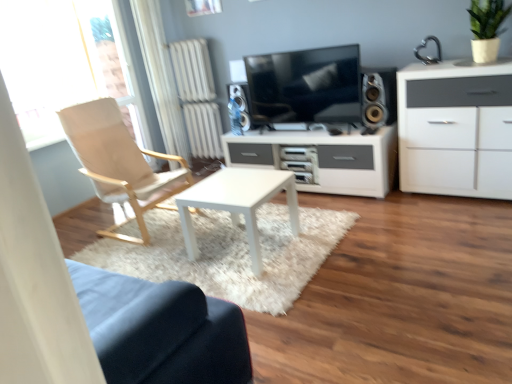
What do you see at coordinates (238, 203) in the screenshot?
I see `white matte coffee table at center` at bounding box center [238, 203].

What do you see at coordinates (456, 129) in the screenshot? I see `white matte cabinet at right` at bounding box center [456, 129].

Describe the element at coordinates (120, 163) in the screenshot. I see `light beige fabric chair at left` at that location.

This screenshot has width=512, height=384. In order to click on satin black speaker at center, the second speaker when ordered from right to left in this screenshot , I will do `click(241, 102)`.

Describe the element at coordinates (65, 62) in the screenshot. I see `transparent glass window at upper left` at that location.

In order to click on white fabric curtain at left in this screenshot , I will do `click(160, 76)`.

Is light beige fabric chair at left positioned before matte black tv at center?

Yes, light beige fabric chair at left is closer to the camera.

Can you confirm if light beige fabric chair at left is thinner than matte black tv at center?

In fact, light beige fabric chair at left might be wider than matte black tv at center.

From the image's perspective, which object appears higher, light beige fabric chair at left or matte black tv at center?

matte black tv at center appears higher in the image.

How many degrees apart are the facing directions of light beige fabric chair at left and matte black tv at center?

The facing directions of light beige fabric chair at left and matte black tv at center are 86.5 degrees apart.

Between white matte cabinet at right and white matte coffee table at center, which one is positioned behind?

white matte cabinet at right is more distant.

Which of these two, white matte cabinet at right or white matte coffee table at center, stands taller?

Standing taller between the two is white matte cabinet at right.

Looking at their sizes, would you say white matte cabinet at right is wider or thinner than white matte coffee table at center?

In the image, white matte cabinet at right appears to be more narrow than white matte coffee table at center.

How many degrees apart are the facing directions of white matte cabinet at right and white matte coffee table at center?

white matte cabinet at right and white matte coffee table at center are facing 0.372 degrees away from each other.

From a real-world perspective, relative to white fabric curtain at left, is white matte cabinet at right vertically above or below?

white matte cabinet at right is situated lower than white fabric curtain at left in the real world.

Which object is positioned more to the left, white matte cabinet at right or white fabric curtain at left?

white fabric curtain at left is more to the left.

Considering the sizes of objects white matte cabinet at right and white fabric curtain at left in the image provided, who is thinner, white matte cabinet at right or white fabric curtain at left?

With smaller width is white fabric curtain at left.

In terms of height, does matte black tv at center look taller or shorter compared to transparent glass window at upper left?

Considering their sizes, matte black tv at center has less height than transparent glass window at upper left.

From a real-world perspective, relative to transparent glass window at upper left, is matte black tv at center vertically above or below?

Clearly, from a real-world perspective, matte black tv at center is below transparent glass window at upper left.

Could you tell me if matte black tv at center is facing transparent glass window at upper left?

No.

Is matte black tv at center thinner than transparent glass window at upper left?

Correct, the width of matte black tv at center is less than that of transparent glass window at upper left.

Who is taller, white fabric curtain at left or transparent glass window at upper left?

white fabric curtain at left.

From the picture: From a real-world perspective, is white fabric curtain at left positioned above or below transparent glass window at upper left?

Clearly, from a real-world perspective, white fabric curtain at left is below transparent glass window at upper left.

Can you tell me how much white fabric curtain at left and transparent glass window at upper left differ in facing direction?

0.566 degrees.

Which object is thinner, white fabric curtain at left or transparent glass window at upper left?

white fabric curtain at left.

Does white matte cabinet at right have a lesser height compared to light beige fabric chair at left?

Yes, white matte cabinet at right is shorter than light beige fabric chair at left.

Does white matte cabinet at right have a lesser width compared to light beige fabric chair at left?

Yes.

Is white matte cabinet at right to the right of light beige fabric chair at left from the viewer's perspective?

Correct, you'll find white matte cabinet at right to the right of light beige fabric chair at left.

From the picture: What's the angular difference between white matte cabinet at right and light beige fabric chair at left's facing directions?

86.6 degrees separate the facing orientations of white matte cabinet at right and light beige fabric chair at left.

Could you tell me if white fabric curtain at left is facing light beige fabric chair at left?

No, white fabric curtain at left is not aimed at light beige fabric chair at left.

Between white fabric curtain at left and light beige fabric chair at left, which one has larger size?

light beige fabric chair at left is bigger.

Which is behind, point (161, 35) or point (91, 152)?

The point (161, 35) is farther.

In the scene shown: From a real-world perspective, is white fabric curtain at left under light beige fabric chair at left?

No.

I want to click on television behind the light beige fabric chair at left, so [x=301, y=83].

What are the coordinates of `coffee table below the white matte cabinet at right (from the image's perspective)` in the screenshot? It's located at click(238, 203).

Estimate the real-world distances between objects in this image. Which object is closer to light beige fabric chair at left, white matte coffee table at center or transparent glass window at upper left?

transparent glass window at upper left is positioned closer to the anchor light beige fabric chair at left.

From the picture: Estimate the real-world distances between objects in this image. Which object is closer to white fabric curtain at left, silver metallic speaker at right, which is the 1th speaker in front-to-back order, or satin black speaker at center, the second speaker when ordered from right to left?

The object closer to white fabric curtain at left is satin black speaker at center, the second speaker when ordered from right to left.

Considering their positions, is white matte coffee table at center positioned closer to green matte plant at upper right than white fabric curtain at left?

Based on the image, white matte coffee table at center appears to be nearer to green matte plant at upper right.

When comparing their distances from satin black speaker at center, the second speaker in the front-to-back sequence, does white fabric curtain at left or white matte coffee table at center seem further?

Among the two, white matte coffee table at center is located further to satin black speaker at center, the second speaker in the front-to-back sequence.

Based on their spatial positions, is white matte cabinet at right or matte black tv at center closer to silver metallic speaker at right, the first speaker in the right-to-left sequence?

Based on the image, matte black tv at center appears to be nearer to silver metallic speaker at right, the first speaker in the right-to-left sequence.

From the image, which object appears to be nearer to light beige fabric chair at left, matte black tv at center or white matte cabinet at right?

matte black tv at center lies closer to light beige fabric chair at left than the other object.

Based on their spatial positions, is white matte coffee table at center or silver metallic speaker at right, which is the 1th speaker in front-to-back order, further from light beige fabric chair at left?

The object further to light beige fabric chair at left is silver metallic speaker at right, which is the 1th speaker in front-to-back order.

Looking at the image, which one is located closer to white matte coffee table at center, white matte cabinet at right or green matte plant at upper right?

white matte cabinet at right lies closer to white matte coffee table at center than the other object.

Find the location of `speaker between light beige fabric chair at left and silver metallic speaker at right, the first speaker in the right-to-left sequence, from left to right`. speaker between light beige fabric chair at left and silver metallic speaker at right, the first speaker in the right-to-left sequence, from left to right is located at coordinates (241, 102).

Image resolution: width=512 pixels, height=384 pixels. In order to click on television between white fabric curtain at left and white matte cabinet at right in the horizontal direction in this screenshot , I will do `click(301, 83)`.

The height and width of the screenshot is (384, 512). Find the location of `chair between white matte coffee table at center and white fabric curtain at left along the z-axis`. chair between white matte coffee table at center and white fabric curtain at left along the z-axis is located at coordinates (120, 163).

In order to click on television between white fabric curtain at left and silver metallic speaker at right, which is the 1th speaker in front-to-back order, in the horizontal direction in this screenshot , I will do `click(301, 83)`.